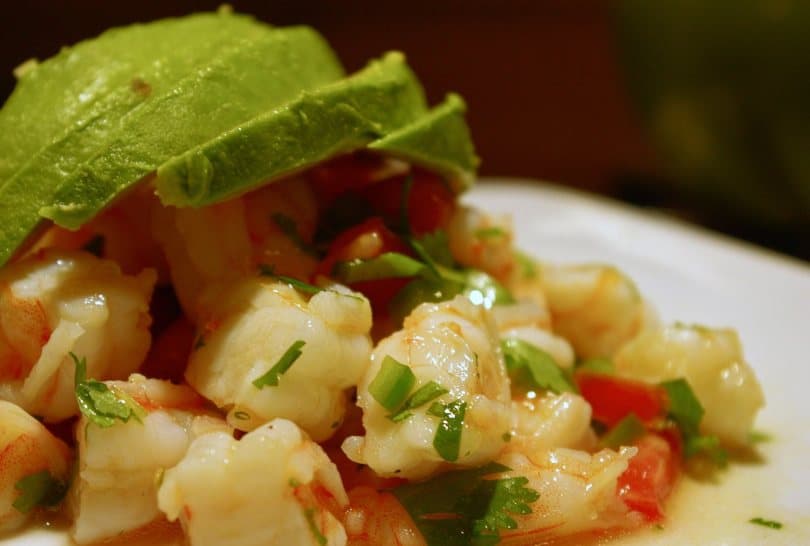
Image resolution: width=810 pixels, height=546 pixels. Identify the location of white plate corner. (539, 170).